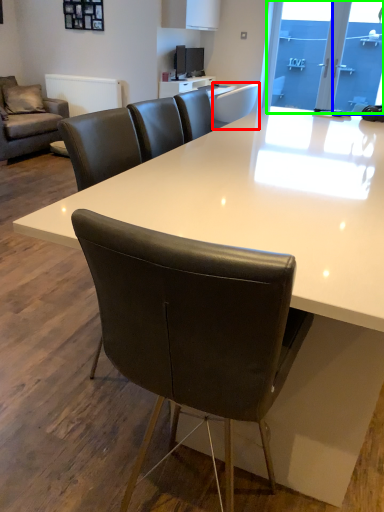
Question: Which object is positioned farthest from chair (highlighted by a red box)? Select from glass door (highlighted by a blue box) and window screen (highlighted by a green box).

Choices:
 (A) glass door
 (B) window screen

Answer: (A)